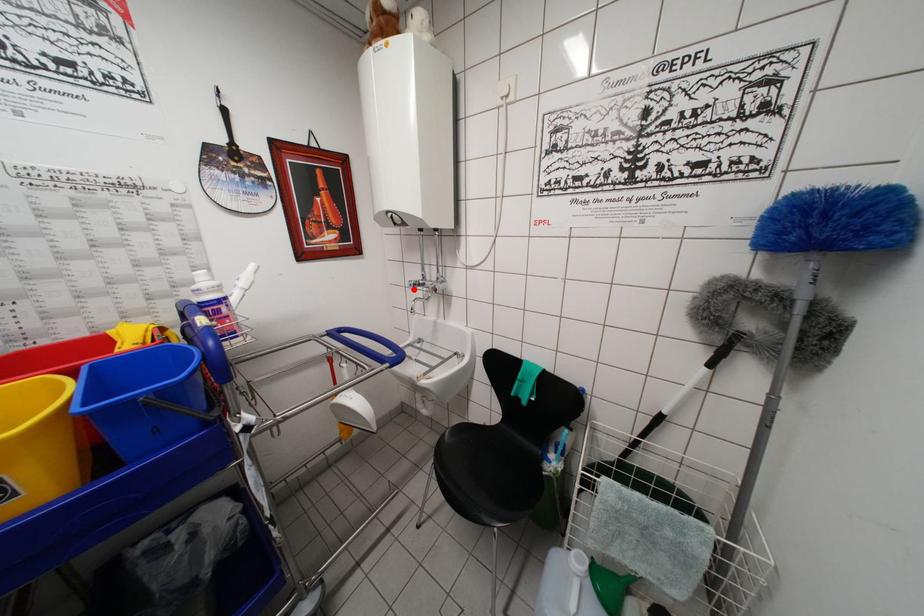
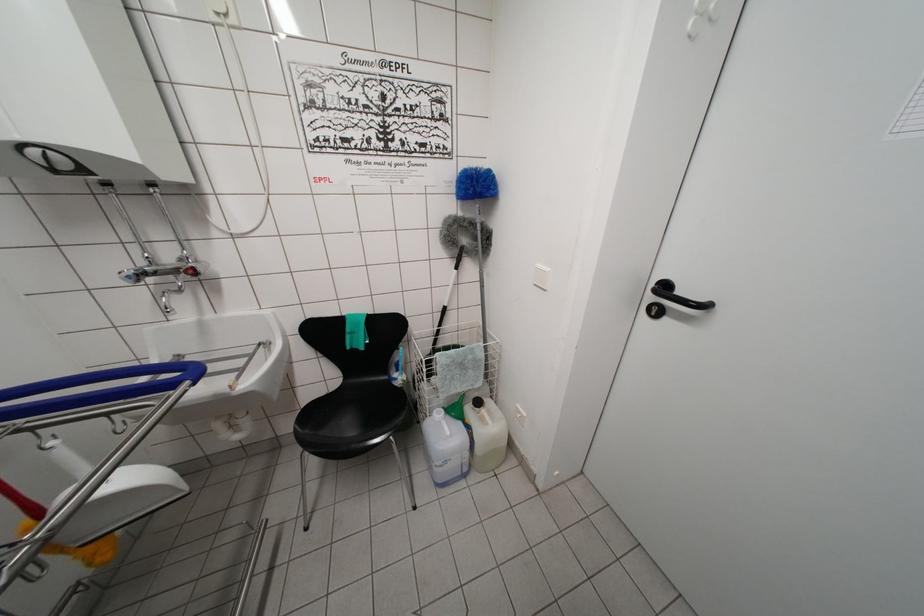
Where in the second image is the point corresponding to the highlighted location from the first image?

(131, 282)